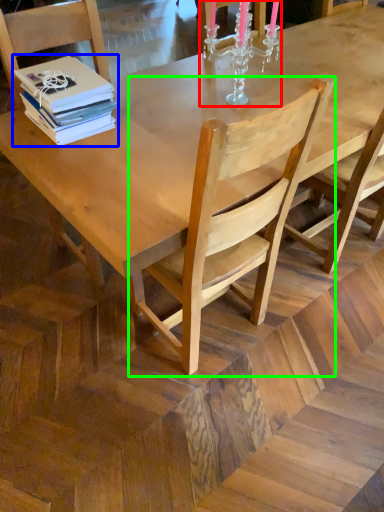
Question: Which is nearer to the candle holder (highlighted by a red box)? book (highlighted by a blue box) or chair (highlighted by a green box).

Choices:
 (A) book
 (B) chair

Answer: (A)